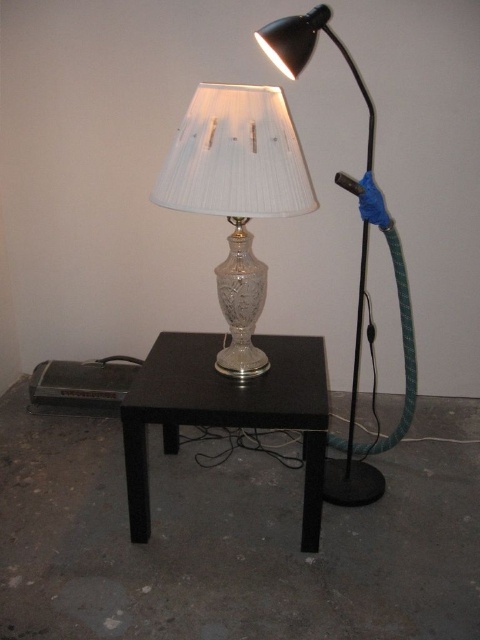
You are a delivery person who needs to place a 24 inch long package between the black glossy table at center and the green rubber hose at right. Is there enough space for the package to fit without overlapping either object?

The distance between the black glossy table at center and the green rubber hose at right is 20.36 inches. Since the package is 24 inches long, it is longer than the available space, so it won not fit without overlapping either object.

You are standing in front of the table and want to place a small object on the table. You have two points marked on the table surface at coordinates point (x=360, y=328) and point (x=403, y=266). Which point is closer to you, the observer?

Point (x=360, y=328) is closer to you, the observer, because it is further to the viewer than point (x=403, y=266).

You are standing in front of the small black table and want to place a book on the table. Which lamp, the silver textured glass table lamp at center or the matte silver glass table lamp at right, is closer to the edge of the table where you can easily reach it?

The matte silver glass table lamp at right is closer to the edge of the table because the silver textured glass table lamp at center is located above it, meaning it is positioned further back on the table.